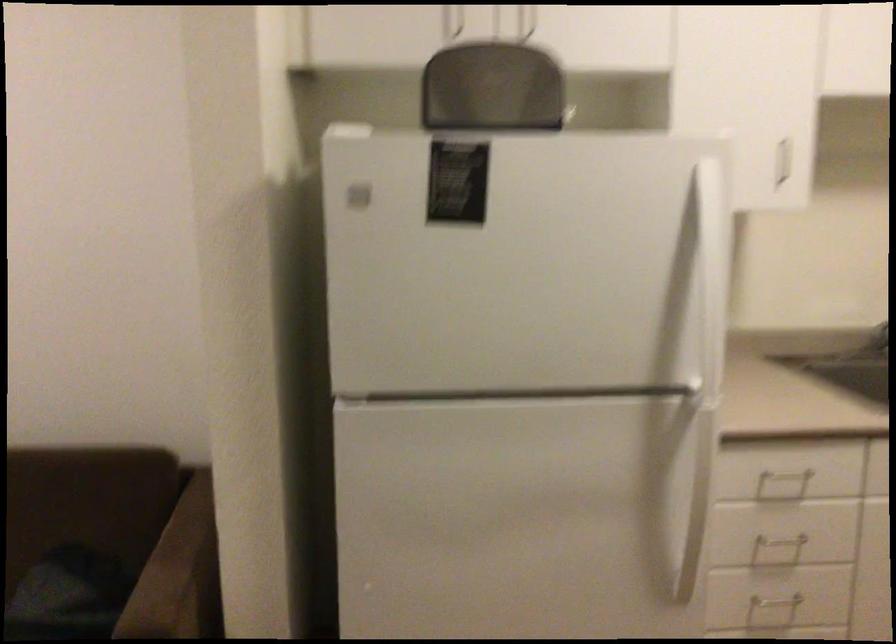
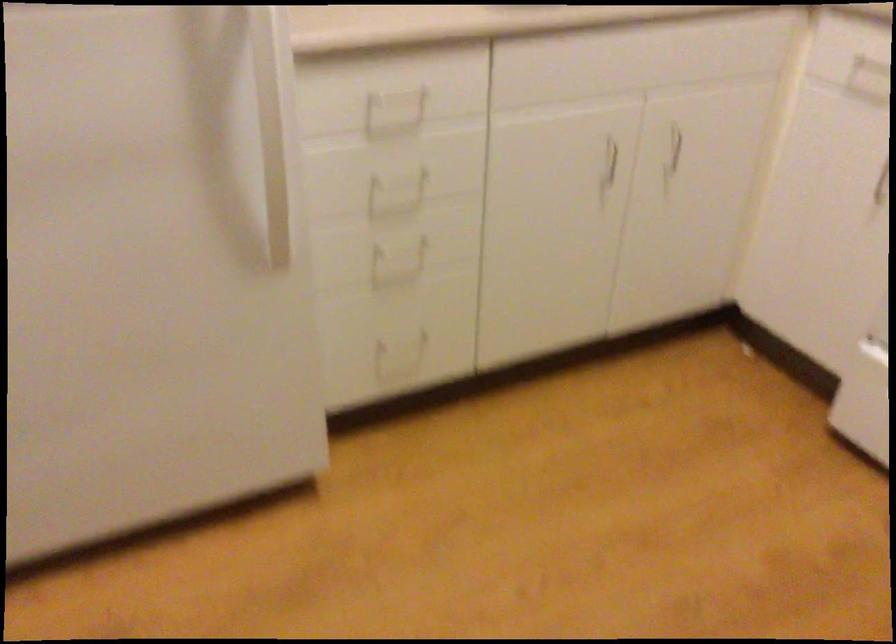
Locate, in the second image, the point that corresponds to the point at 788,544 in the first image.

(405, 178)